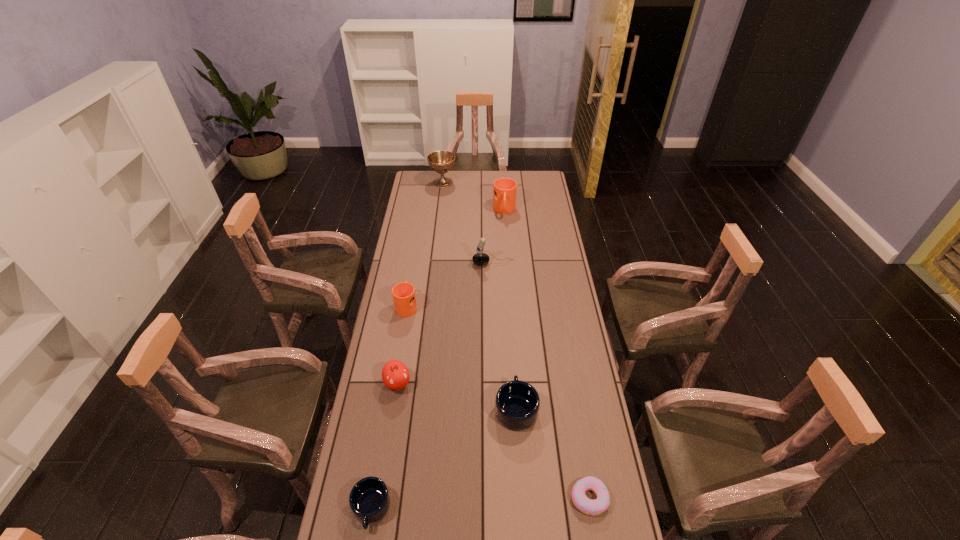
This screenshot has width=960, height=540. What are the coordinates of `the farther blue mug` in the screenshot? It's located at (517, 403).

Where is `the seventh tallest object`? The width and height of the screenshot is (960, 540). the seventh tallest object is located at coordinates (369, 499).

Locate an element on the screen. The width and height of the screenshot is (960, 540). the left blue mug is located at coordinates (369, 499).

Find the location of a particular element. The image size is (960, 540). doughnut is located at coordinates point(588,506).

Where is `the shortest object`? This screenshot has width=960, height=540. the shortest object is located at coordinates (588, 506).

This screenshot has width=960, height=540. I want to click on vacant space situated on the left of the red chalice, so [418, 183].

You are a GUI agent. You are given a task and a screenshot of the screen. Output one action in this format:
    pyautogui.click(x=<x>, y=<y>)
    Task: Click on the vacant position located on the handle side of the right orange mug
    This screenshot has width=960, height=540.
    Given the screenshot: What is the action you would take?
    pyautogui.click(x=508, y=265)

I want to click on blank area located on the back of the third farthest object, so click(492, 214).

Where is `vacant area situated 0.390m on the handle side of the left orange mug`? vacant area situated 0.390m on the handle side of the left orange mug is located at coordinates (418, 240).

Locate an element on the screen. The width and height of the screenshot is (960, 540). vacant space located on the handle side of the left orange mug is located at coordinates (412, 278).